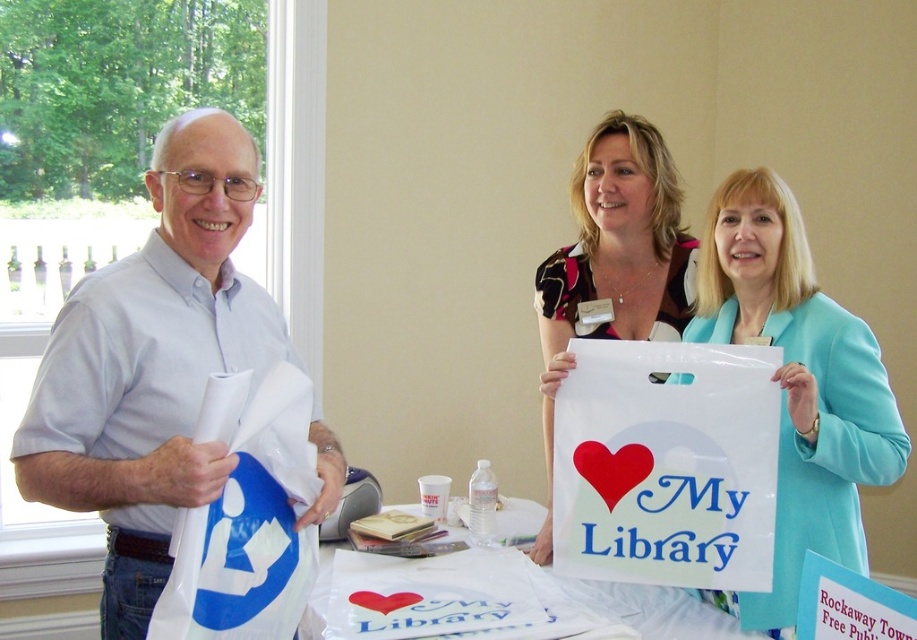
You are at the library event and need to place a new promotional item on the table. The item must be placed between the two points labeled point (683, 317) and point (686, 618). Which point should you place it closer to if you want it to be in front of both?

To place the item in front of both points, you should position it closer to point (686, 618) since point (683, 317) is behind point (686, 618).

Based on the photo, you are organizing a library event and need to place a decorative item between the printed fabric heart at center and the white plastic bag at center on the table. The decorative item is 12 inches wide. Will there be enough space between them to fit it?

The distance between the printed fabric heart at center and the white plastic bag at center is 26.14 inches. Since the decorative item is 12 inches wide, there is sufficient space to place it between them as 26.14 inches is greater than 12 inches.